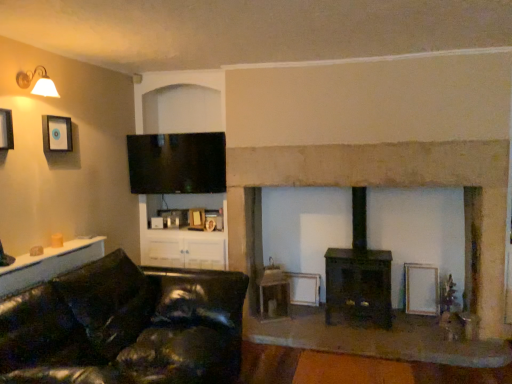
Find the location of `vacant area on top of white glossy cabinet at lower left (from a real-world perspective)`. vacant area on top of white glossy cabinet at lower left (from a real-world perspective) is located at coordinates (47, 254).